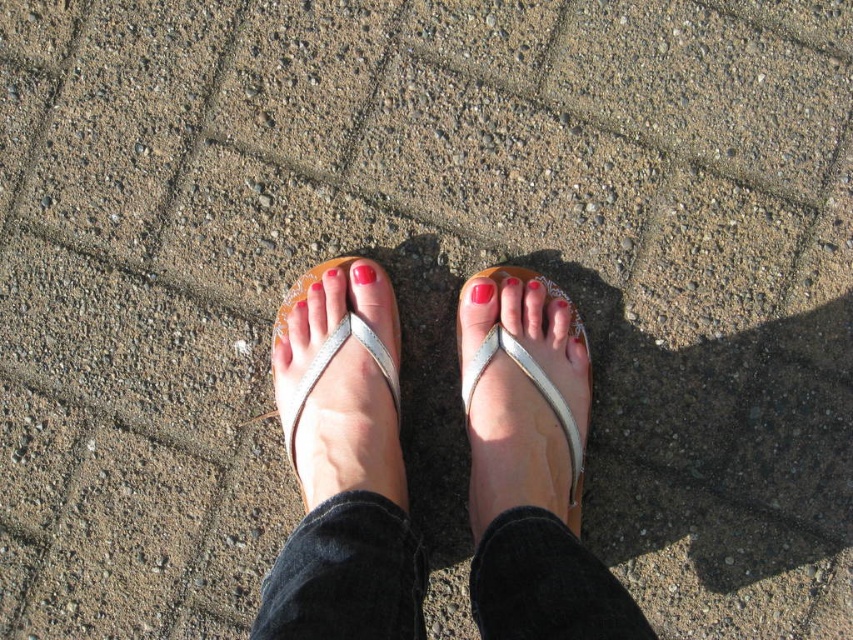
Question: Which object is positioned closest to the glossy pink nail at center?

Choices:
 (A) matte white toe at center
 (B) silver metallic flip-flop at center
 (C) shiny silver sandal at center

Answer: (B)

Question: Can you confirm if silver metallic flip-flop at center is positioned above matte white toe at center?

Choices:
 (A) yes
 (B) no

Answer: (B)

Question: Which of these objects is positioned farthest from the glossy pink nail at center?

Choices:
 (A) shiny metallic sandals at center
 (B) shiny silver sandal at center
 (C) silver metallic flip-flop at center
 (D) matte white toe at center

Answer: (A)

Question: Does shiny silver sandal at center have a smaller size compared to matte white toe at center?

Choices:
 (A) no
 (B) yes

Answer: (A)

Question: Is shiny silver sandal at center to the left of matte white toe at center from the viewer's perspective?

Choices:
 (A) yes
 (B) no

Answer: (A)

Question: Which of the following is the farthest from the observer?

Choices:
 (A) shiny silver sandal at center
 (B) glossy pink nail at center

Answer: (B)